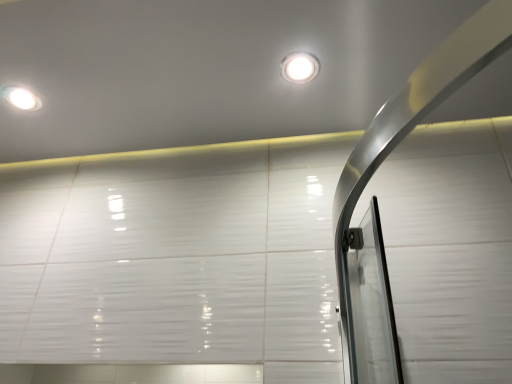
Question: In terms of size, does matte white droplight at upper left, marked as the first droplight in a back-to-front arrangement, appear bigger or smaller than white glossy droplight at upper center, placed as the 2th droplight when sorted from back to front?

Choices:
 (A) big
 (B) small

Answer: (B)

Question: From the image's perspective, relative to white glossy droplight at upper center, placed as the 2th droplight when sorted from back to front, is matte white droplight at upper left, positioned as the 2th droplight in front-to-back order, above or below?

Choices:
 (A) above
 (B) below

Answer: (B)

Question: From a real-world perspective, is matte white droplight at upper left, which is the 2th droplight from right to left, positioned above or below white glossy droplight at upper center, the 1th droplight positioned from the right?

Choices:
 (A) above
 (B) below

Answer: (A)

Question: Considering the relative positions of white glossy droplight at upper center, placed as the 2th droplight when sorted from back to front, and matte white droplight at upper left, marked as the first droplight in a back-to-front arrangement, in the image provided, is white glossy droplight at upper center, placed as the 2th droplight when sorted from back to front, to the left or to the right of matte white droplight at upper left, marked as the first droplight in a back-to-front arrangement,?

Choices:
 (A) left
 (B) right

Answer: (B)

Question: From a real-world perspective, is white glossy droplight at upper center, the 1th droplight positioned from the right, positioned above or below matte white droplight at upper left, positioned as the 2th droplight in front-to-back order?

Choices:
 (A) above
 (B) below

Answer: (B)

Question: From the image's perspective, is white glossy droplight at upper center, the 1th droplight viewed from the front, above or below matte white droplight at upper left, positioned as the 2th droplight in front-to-back order?

Choices:
 (A) below
 (B) above

Answer: (B)

Question: Considering the positions of point (287, 64) and point (40, 104), is point (287, 64) closer or farther from the camera than point (40, 104)?

Choices:
 (A) farther
 (B) closer

Answer: (B)